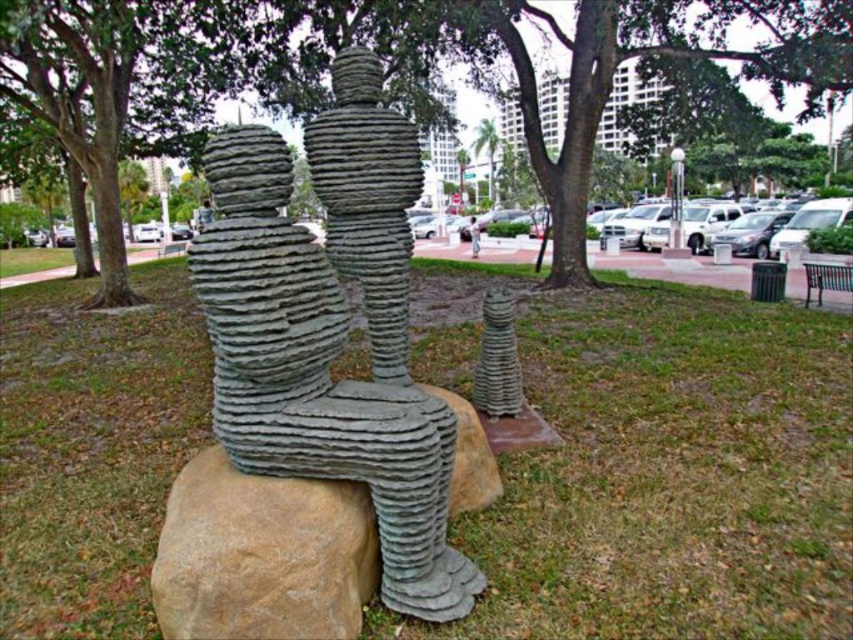
Question: Can you confirm if green grass at center is positioned to the left of dark blue fabric jacket at upper center?

Choices:
 (A) no
 (B) yes

Answer: (A)

Question: Which object is the closest to the green grass at center?

Choices:
 (A) green leafy tree at center
 (B) brown rough stone at center
 (C) green textured tree at center
 (D) light brown wooden bench at center

Answer: (B)

Question: From the image, what is the correct spatial relationship of green textured tree at center in relation to dark blue fabric jacket at upper center?

Choices:
 (A) left
 (B) right

Answer: (B)

Question: Which point is closer to the camera?

Choices:
 (A) rusty metal sculpture at center
 (B) light brown wooden bench at center
 (C) green leafy tree at center
 (D) green textured tree at center

Answer: (A)

Question: Can you confirm if green textured tree at center is smaller than brown rough stone at center?

Choices:
 (A) yes
 (B) no

Answer: (B)

Question: Which of the following is the closest to the observer?

Choices:
 (A) (207, 216)
 (B) (351, 609)

Answer: (B)